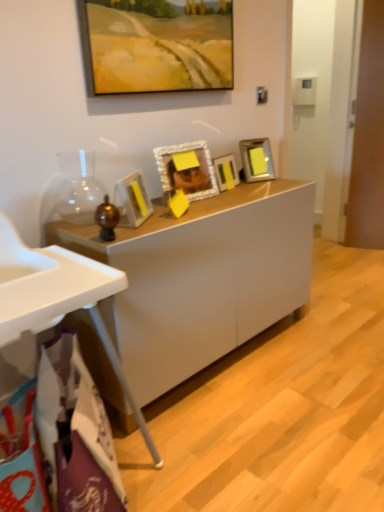
Where is `free space to the right of matte yellow picture frame at center, which appears as the 5th picture frame when viewed from the top`? This screenshot has height=512, width=384. free space to the right of matte yellow picture frame at center, which appears as the 5th picture frame when viewed from the top is located at coordinates pos(181,215).